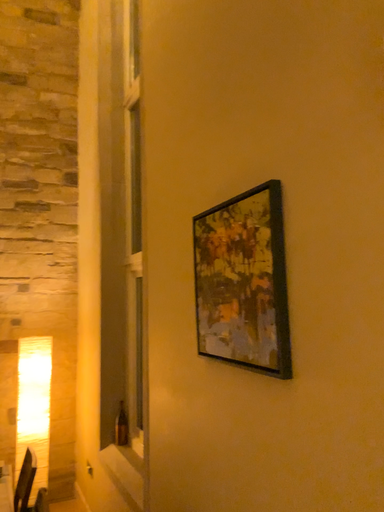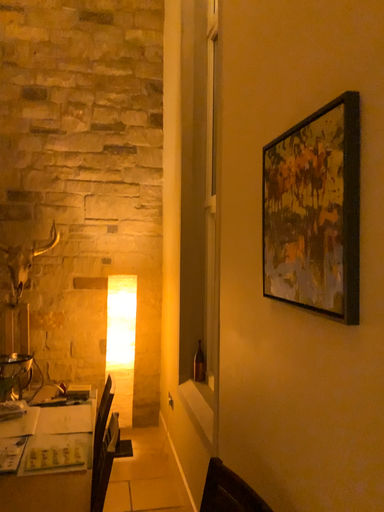
Question: How did the camera likely rotate when shooting the video?

Choices:
 (A) rotated downward
 (B) rotated upward

Answer: (A)